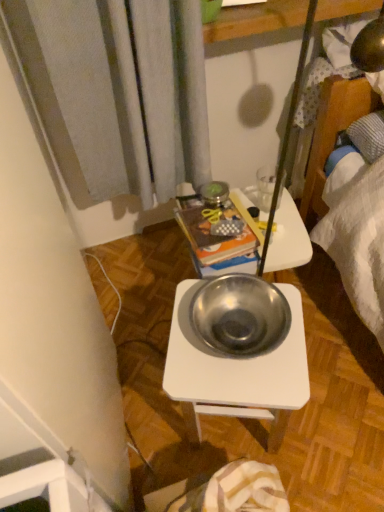
The width and height of the screenshot is (384, 512). Identify the location of empty space that is ontop of metallic books at center. (213, 218).